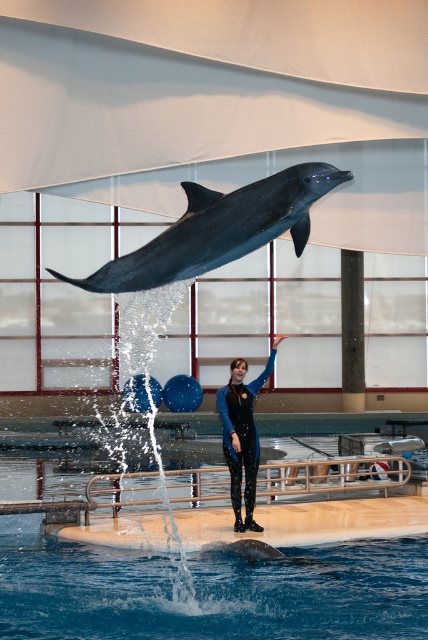
You are a visitor standing at the entrance of the aquatic facility. You want to take a photo of the dolphin. The dolphin is represented by the point at coordinates point (219, 228). Where should you position yourself to capture the dolphin in the center of your photo?

To capture the dolphin represented by the point at coordinates point (219, 228) in the center of your photo, you should position yourself directly facing the dolphin, ensuring the point is centered in your camera viewfinder.

You are a safety inspector evaluating the aquatic facility. The safety guidelines state that the water level must be at least 2 meters higher than any submerged object to ensure safety. Given the current setup, does the blue liquid water at center meet the safety requirement compared to the shiny dark blue dolphin at center?

The blue liquid water at center has a lesser height compared to the shiny dark blue dolphin at center, so it does not meet the safety requirement as the water level is lower than the dolphin, violating the guideline of being at least 2 meters higher.

In the scene shown: You are a drone operator trying to capture aerial footage of the dolphin in the center of the pool. The drone has a camera that can only focus on objects within a 0.5 unit radius. Given that the point marking blue liquid water at center is located at coordinates point (210,592), will the drone be able to capture the dolphin mid leap if it is centered at this point?

The point marking blue liquid water at center is located at coordinates point (210,592). Since the dolphin is mid leap above the water at the center, the drone centered at this point would be able to capture the dolphin as it is within the 0.5 unit radius.